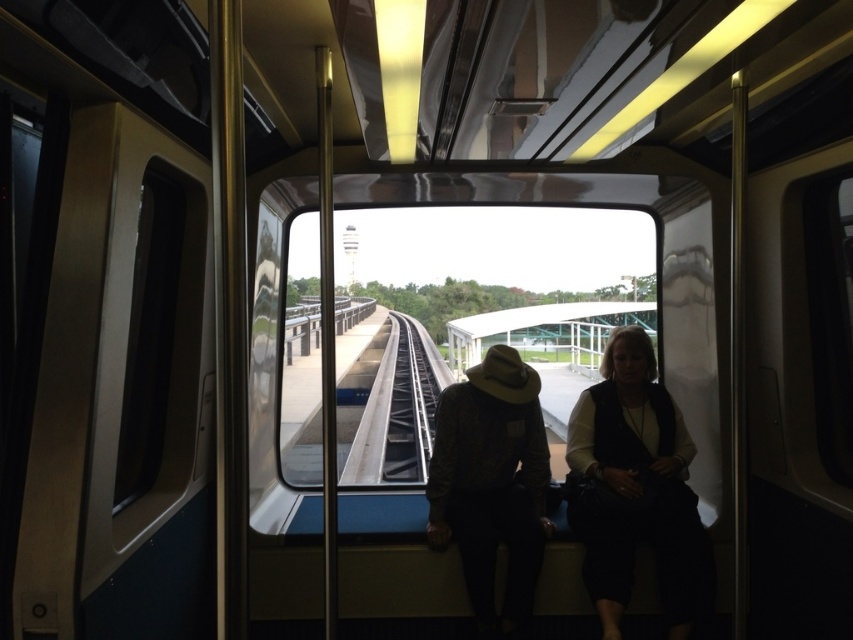
You are a passenger sitting in the train car and notice an object near the window. Based on the coordinates provided, can you identify what is located at point (637, 490)?

The point (637, 490) indicates the location of the black fabric vest at right.

You are a passenger seated in the train car and want to know how far the point at coordinates (390,452) is from your current position. Can you determine the distance?

The point at coordinates (390,452) is 8.99 meters away from the camera, so the distance from your current position to that point is approximately 8.99 meters.

You are a passenger on the train and want to pick up the leather hat at center from your seat. Can you reach it without leaving your seat?

The leather hat at center is 2.92 meters from the camera, which is likely out of reach from your seat. You would need to move closer to retrieve it.